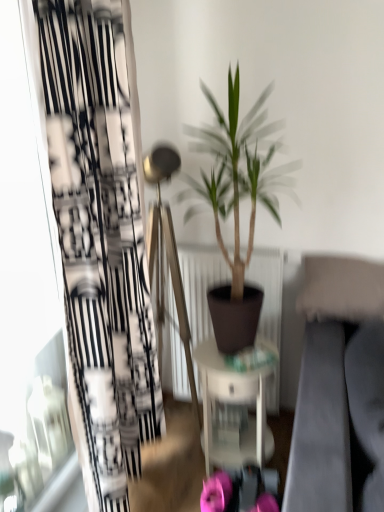
Question: Is pink fabric flower at lower center, the 2th flower positioned from the right, turned away from green matte plant at center?

Choices:
 (A) no
 (B) yes

Answer: (A)

Question: Does pink fabric flower at lower center, the 2th flower positioned from the right, have a larger size compared to green matte plant at center?

Choices:
 (A) no
 (B) yes

Answer: (A)

Question: Can you confirm if pink fabric flower at lower center, the first flower viewed from the left, is smaller than green matte plant at center?

Choices:
 (A) yes
 (B) no

Answer: (A)

Question: Can you confirm if pink fabric flower at lower center, the 2th flower positioned from the right, is positioned to the right of green matte plant at center?

Choices:
 (A) yes
 (B) no

Answer: (B)

Question: Is pink fabric flower at lower center, the first flower viewed from the left, in contact with green matte plant at center?

Choices:
 (A) no
 (B) yes

Answer: (A)

Question: From the image's perspective, relative to pink fabric flower at lower center, the 2th flower positioned from the right, is green matte plant at center above or below?

Choices:
 (A) above
 (B) below

Answer: (A)

Question: From a real-world perspective, is green matte plant at center above or below pink fabric flower at lower center, the 2th flower positioned from the right?

Choices:
 (A) above
 (B) below

Answer: (A)

Question: Would you say green matte plant at center is to the left or to the right of pink fabric flower at lower center, the 2th flower positioned from the right, in the picture?

Choices:
 (A) left
 (B) right

Answer: (B)

Question: Is point (215, 301) closer or farther from the camera than point (228, 480)?

Choices:
 (A) closer
 (B) farther

Answer: (B)

Question: Considering their positions, is pink fabric flower at lower center, which is counted as the 1th flower, starting from the right, located in front of or behind white glossy table at center?

Choices:
 (A) front
 (B) behind

Answer: (A)

Question: Is pink fabric flower at lower center, the second flower viewed from the left, to the left or to the right of white glossy table at center in the image?

Choices:
 (A) left
 (B) right

Answer: (B)

Question: From a real-world perspective, is pink fabric flower at lower center, which is counted as the 1th flower, starting from the right, above or below white glossy table at center?

Choices:
 (A) below
 (B) above

Answer: (A)

Question: Considering the positions of pink fabric flower at lower center, the second flower viewed from the left, and white glossy table at center in the image, is pink fabric flower at lower center, the second flower viewed from the left, wider or thinner than white glossy table at center?

Choices:
 (A) wide
 (B) thin

Answer: (B)

Question: Which is correct: white glossy table at center is inside green matte plant at center, or outside of it?

Choices:
 (A) outside
 (B) inside

Answer: (A)

Question: Considering the positions of point (218, 361) and point (276, 197), is point (218, 361) closer or farther from the camera than point (276, 197)?

Choices:
 (A) farther
 (B) closer

Answer: (B)